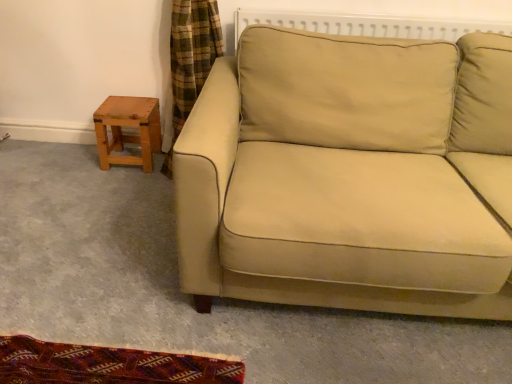
Question: Is light brown wooden stool at left bigger or smaller than beige fabric couch at center?

Choices:
 (A) big
 (B) small

Answer: (B)

Question: Considering the positions of point (96, 124) and point (207, 140), is point (96, 124) closer or farther from the camera than point (207, 140)?

Choices:
 (A) farther
 (B) closer

Answer: (A)

Question: From the image's perspective, is light brown wooden stool at left positioned above or below beige fabric couch at center?

Choices:
 (A) below
 (B) above

Answer: (B)

Question: Is point (227, 125) positioned closer to the camera than point (105, 114)?

Choices:
 (A) closer
 (B) farther

Answer: (A)

Question: Considering the positions of beige fabric couch at center and light brown wooden stool at left in the image, is beige fabric couch at center taller or shorter than light brown wooden stool at left?

Choices:
 (A) tall
 (B) short

Answer: (A)

Question: Considering their positions, is beige fabric couch at center located in front of or behind light brown wooden stool at left?

Choices:
 (A) front
 (B) behind

Answer: (A)

Question: From a real-world perspective, relative to light brown wooden stool at left, is beige fabric couch at center vertically above or below?

Choices:
 (A) above
 (B) below

Answer: (A)